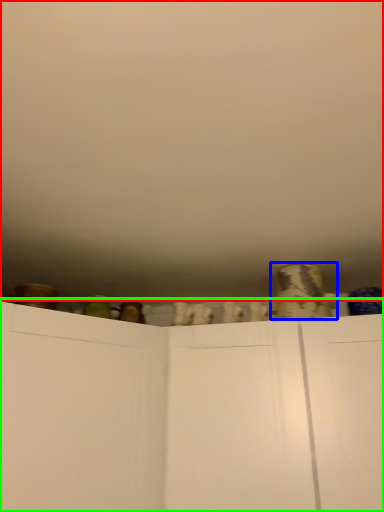
Question: Estimate the real-world distances between objects in this image. Which object is farther from backdrop (highlighted by a red box), pottery (highlighted by a blue box) or cupboard (highlighted by a green box)?

Choices:
 (A) pottery
 (B) cupboard

Answer: (A)